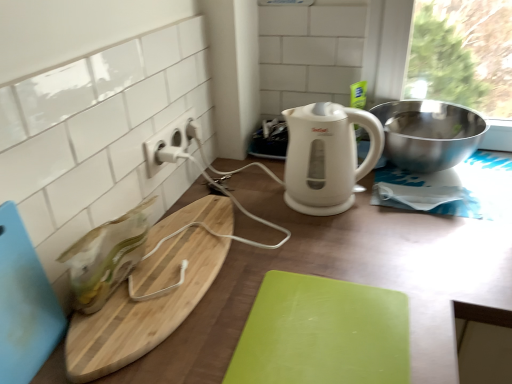
Locate an element on the screen. The height and width of the screenshot is (384, 512). spots to the right of white glossy electric kettle at center is located at coordinates pos(422,222).